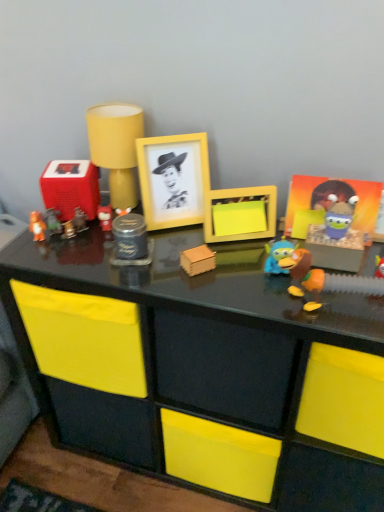
Locate an element on the screen. unoccupied region to the right of orange matte bear at left, which is the 1th toy in left-to-right order is located at coordinates (110, 254).